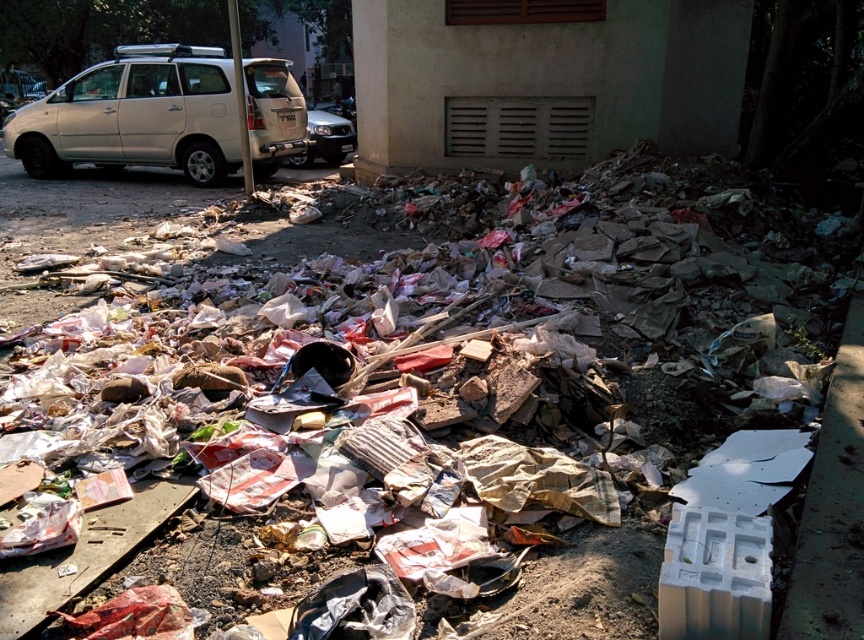
Question: Is silver metallic van at upper left thinner than silver metallic suv at center?

Choices:
 (A) no
 (B) yes

Answer: (A)

Question: Which point is farther to the camera?

Choices:
 (A) (321, 115)
 (B) (68, 86)

Answer: (A)

Question: Does silver metallic van at upper left have a smaller size compared to silver metallic suv at center?

Choices:
 (A) yes
 (B) no

Answer: (A)

Question: Which point appears farthest from the camera in this image?

Choices:
 (A) (233, 131)
 (B) (325, 132)

Answer: (B)

Question: Is the position of silver metallic van at upper left less distant than that of silver metallic suv at center?

Choices:
 (A) no
 (B) yes

Answer: (B)